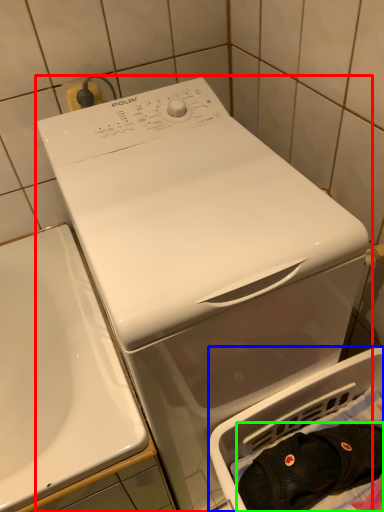
Question: Which object is the farthest from washing machine (highlighted by a red box)? Choose among these: dish washer (highlighted by a blue box) or clothing (highlighted by a green box).

Choices:
 (A) dish washer
 (B) clothing

Answer: (B)